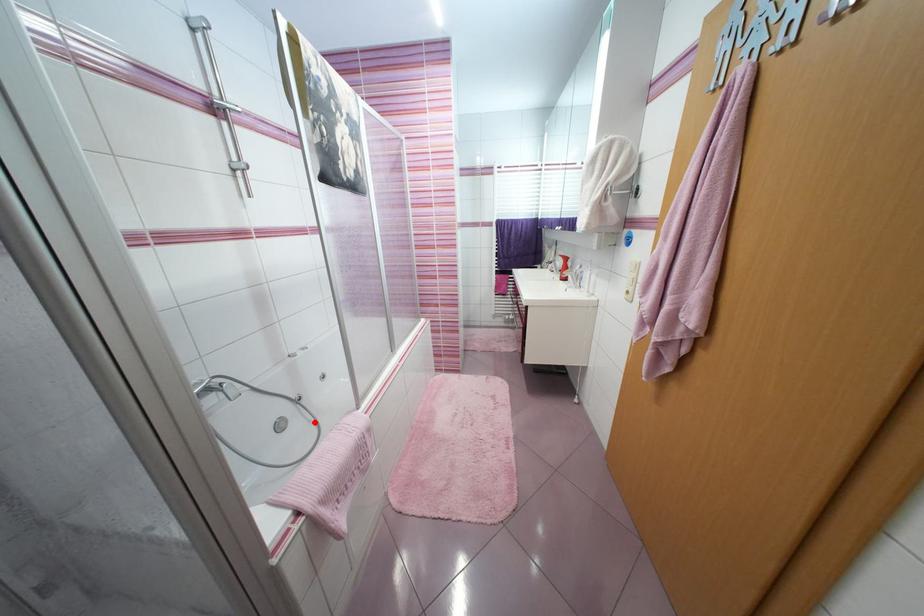
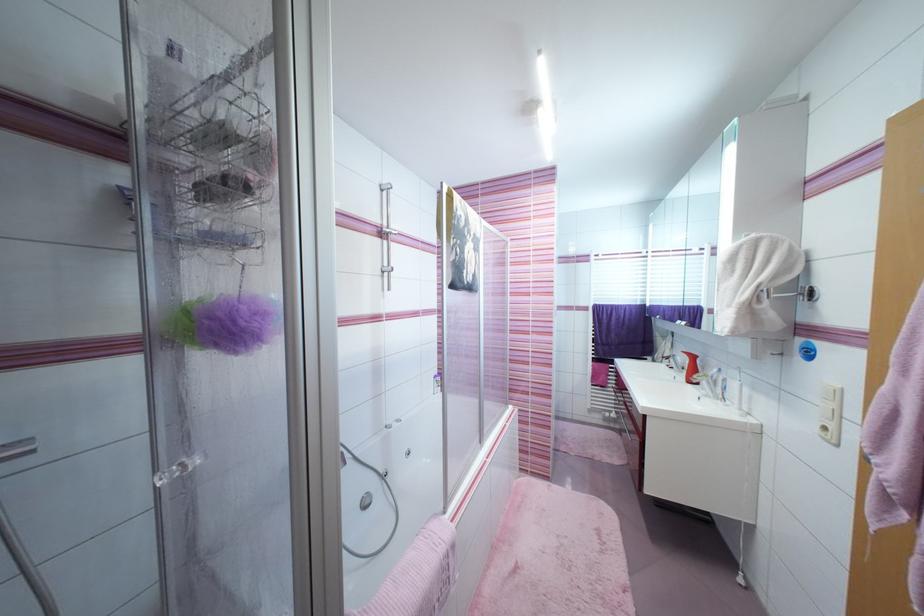
Question: I am providing you with two images of the same scene from different viewpoints. In image1, a red point is highlighted. Considering the same 3D point in image2, which of the following is correct?

Choices:
 (A) It is closer
 (B) It is farther

Answer: (B)